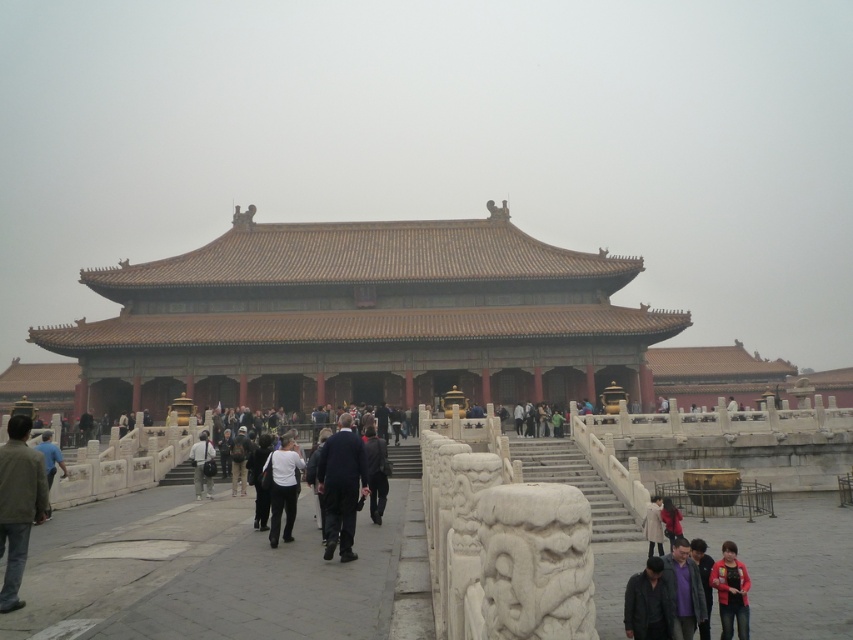
Question: Which of the following is the farthest from the observer?

Choices:
 (A) (677, 522)
 (B) (352, 522)

Answer: (A)

Question: Considering the relative positions of white matte jacket at center and dark brown leather jacket at lower right in the image provided, where is white matte jacket at center located with respect to dark brown leather jacket at lower right?

Choices:
 (A) below
 (B) above

Answer: (B)

Question: Estimate the real-world distances between objects in this image. Which object is farther from the dark gray fabric jacket at lower center?

Choices:
 (A) dark brown leather jacket at lower right
 (B) blue fabric shirt at lower left

Answer: (B)

Question: Does brown tiled roof at center have a lesser width compared to light gray fabric jacket at center?

Choices:
 (A) no
 (B) yes

Answer: (A)

Question: Which point is closer to the camera?

Choices:
 (A) white matte jacket at center
 (B) red fabric jacket at lower right
 (C) light gray fabric jacket at center

Answer: (B)

Question: Can you confirm if light brown leather jacket at lower left is positioned below purple fabric jacket at lower center?

Choices:
 (A) yes
 (B) no

Answer: (B)